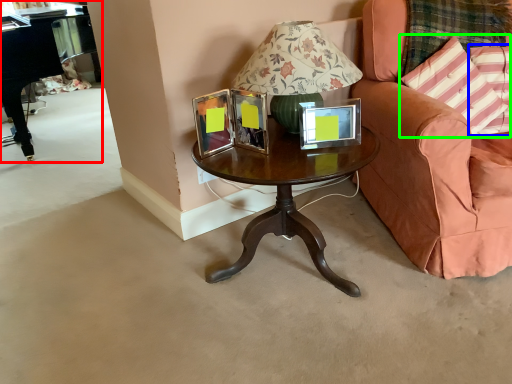
Question: Which object is positioned closest to piano (highlighted by a red box)? Select from pillow (highlighted by a blue box) and pillow (highlighted by a green box).

Choices:
 (A) pillow
 (B) pillow

Answer: (B)